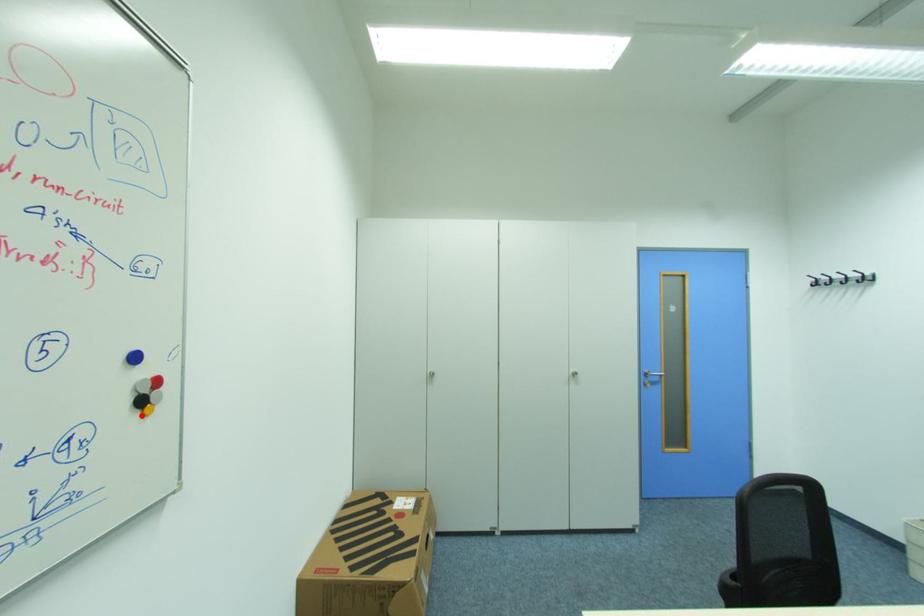
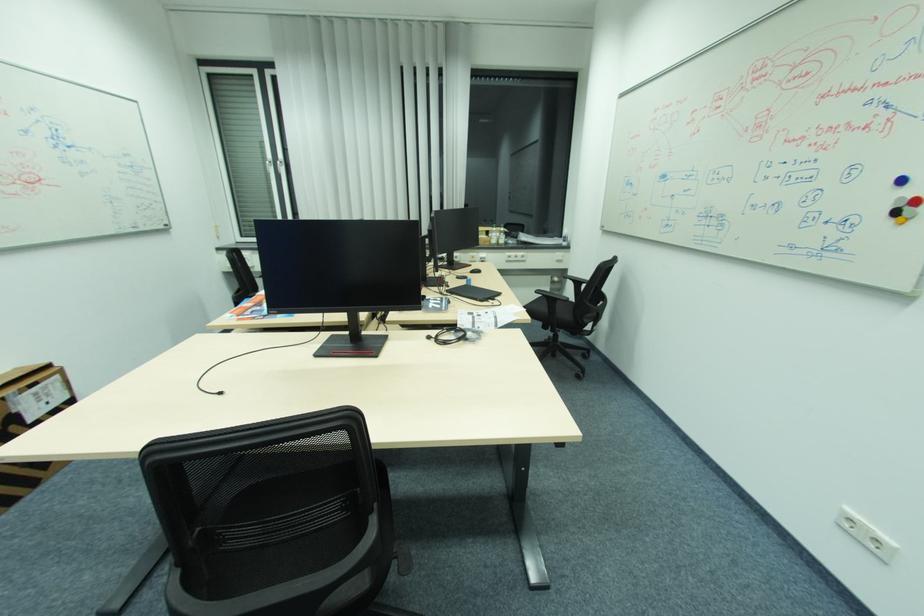
Locate, in the second image, the point that corresponds to the highlighted location in the first image.

(896, 221)